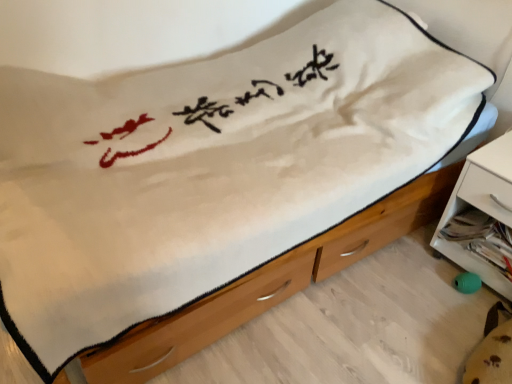
Question: From the image's perspective, does white plastic nightstand at lower right appear lower than wooden chest of drawers at center?

Choices:
 (A) no
 (B) yes

Answer: (A)

Question: Can you confirm if white plastic nightstand at lower right is positioned to the right of wooden chest of drawers at center?

Choices:
 (A) no
 (B) yes

Answer: (B)

Question: From a real-world perspective, is white plastic nightstand at lower right over wooden chest of drawers at center?

Choices:
 (A) yes
 (B) no

Answer: (A)

Question: Considering the relative sizes of white plastic nightstand at lower right and wooden chest of drawers at center in the image provided, is white plastic nightstand at lower right smaller than wooden chest of drawers at center?

Choices:
 (A) no
 (B) yes

Answer: (A)

Question: Is white plastic nightstand at lower right completely or partially outside of wooden chest of drawers at center?

Choices:
 (A) yes
 (B) no

Answer: (A)

Question: Is white plastic nightstand at lower right aimed at wooden chest of drawers at center?

Choices:
 (A) no
 (B) yes

Answer: (B)

Question: Is wooden chest of drawers at center aimed at white plastic nightstand at lower right?

Choices:
 (A) yes
 (B) no

Answer: (B)

Question: From a real-world perspective, does wooden chest of drawers at center sit lower than white plastic nightstand at lower right?

Choices:
 (A) yes
 (B) no

Answer: (A)

Question: From the image's perspective, is wooden chest of drawers at center on white plastic nightstand at lower right?

Choices:
 (A) yes
 (B) no

Answer: (B)

Question: Is the depth of wooden chest of drawers at center greater than that of white plastic nightstand at lower right?

Choices:
 (A) no
 (B) yes

Answer: (A)

Question: Does wooden chest of drawers at center have a greater width compared to white plastic nightstand at lower right?

Choices:
 (A) yes
 (B) no

Answer: (A)

Question: From the image's perspective, does wooden chest of drawers at center appear lower than white plastic nightstand at lower right?

Choices:
 (A) no
 (B) yes

Answer: (B)

Question: In the image, is white plastic nightstand at lower right on the left side or the right side of wooden chest of drawers at center?

Choices:
 (A) right
 (B) left

Answer: (A)